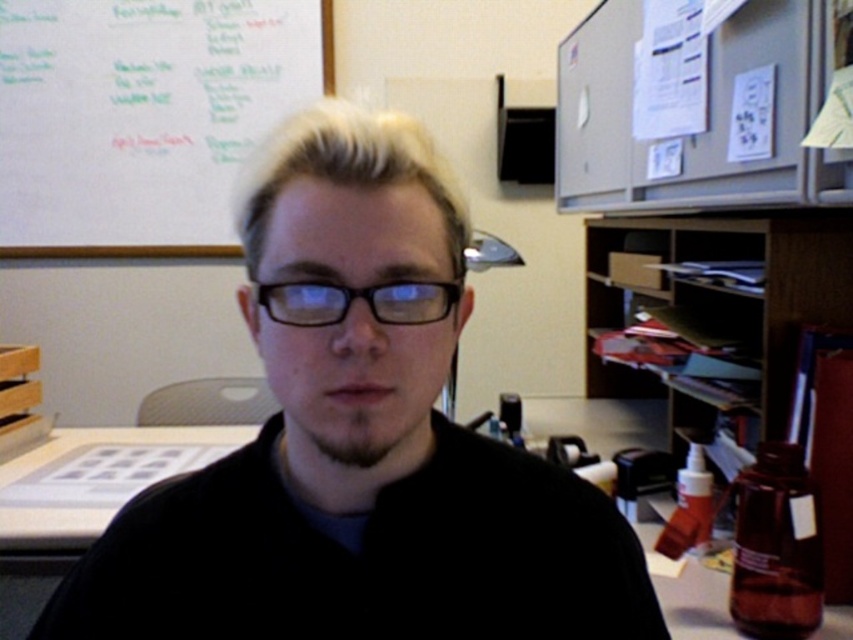
Question: Which of the following is the closest to the observer?

Choices:
 (A) (593, 403)
 (B) (438, 259)
 (C) (257, 83)
 (D) (431, 310)

Answer: (D)

Question: Which object appears closest to the camera in this image?

Choices:
 (A) black matte shirt at center
 (B) black plastic glasses at center

Answer: (A)

Question: Is black matte shirt at center positioned at the back of matte black desk at center?

Choices:
 (A) yes
 (B) no

Answer: (B)

Question: Considering the relative positions of black matte shirt at center and black plastic glasses at center in the image provided, where is black matte shirt at center located with respect to black plastic glasses at center?

Choices:
 (A) right
 (B) left

Answer: (B)

Question: Which point is farther from the camera taking this photo?

Choices:
 (A) (276, 0)
 (B) (706, 621)

Answer: (A)

Question: Can you confirm if black matte shirt at center is wider than black plastic glasses at center?

Choices:
 (A) no
 (B) yes

Answer: (B)